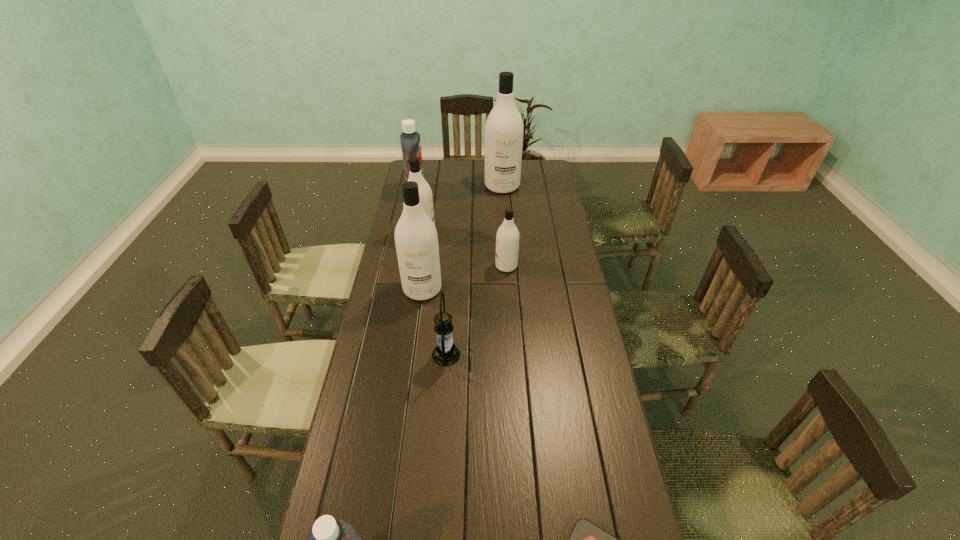
Locate an element on the screen. This screenshot has height=540, width=960. the tallest object is located at coordinates (504, 127).

Locate an element on the screen. the tallest shampoo is located at coordinates (504, 127).

Image resolution: width=960 pixels, height=540 pixels. I want to click on the second tallest shampoo, so click(416, 240).

The image size is (960, 540). What are the coordinates of `the seventh shortest object` in the screenshot? It's located at [416, 240].

Find the location of a particular element. This screenshot has height=540, width=960. the bigger blue shampoo is located at coordinates (410, 140).

The image size is (960, 540). Identify the location of the third farthest shampoo. (425, 193).

You are a GUI agent. You are given a task and a screenshot of the screen. Output one action in this format:
    pyautogui.click(x=<x>, y=<y>)
    Task: Click on the sixth nearest object
    The width and height of the screenshot is (960, 540).
    Given the screenshot: What is the action you would take?
    pyautogui.click(x=425, y=193)

The height and width of the screenshot is (540, 960). Find the location of `lantern`. lantern is located at coordinates (445, 353).

Locate an element on the screen. This screenshot has width=960, height=540. green lantern is located at coordinates (445, 353).

Where is `the fourth farthest shampoo`? The height and width of the screenshot is (540, 960). the fourth farthest shampoo is located at coordinates (507, 238).